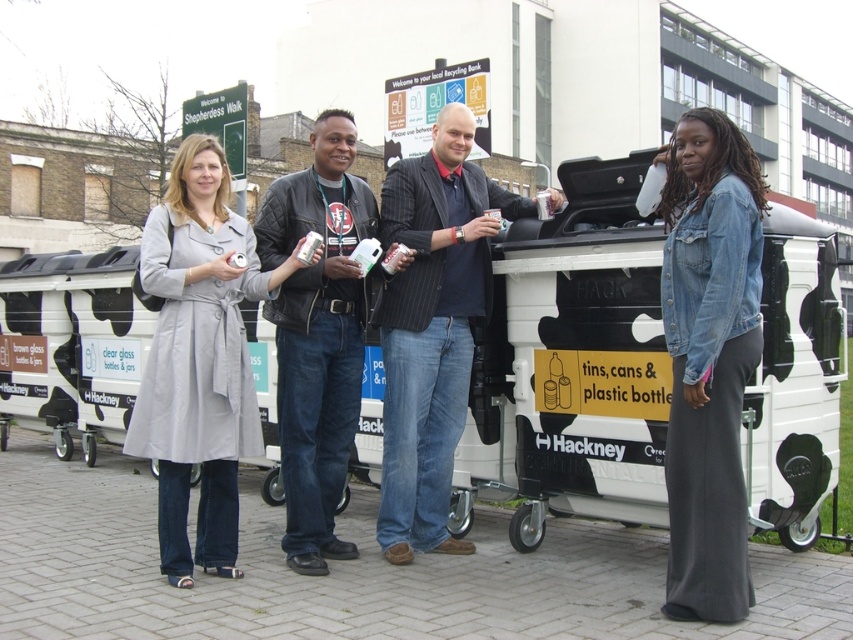
You are at the Hackney recycling station and need to place a recyclable item into the bin. You have a white plastic container at center and a denim jacket at lower right. Which item should you put in the recycling bin labeled for tins, cans, and plastic bottles?

The white plastic container at center should be placed in the recycling bin labeled for tins, cans, and plastic bottles because it is made of plastic. The denim jacket at lower right is clothing and not accepted in this bin.